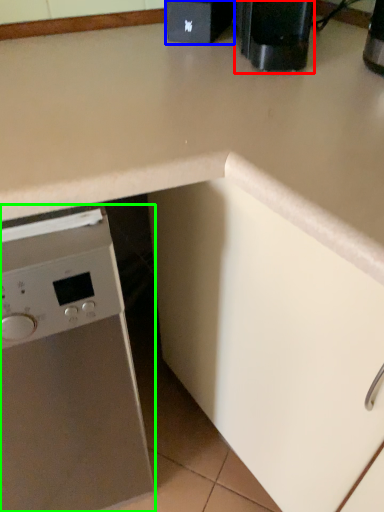
Question: Based on their relative distances, which object is nearer to coffee machine (highlighted by a red box)? Choose from appliance (highlighted by a blue box) and home appliance (highlighted by a green box).

Choices:
 (A) appliance
 (B) home appliance

Answer: (A)